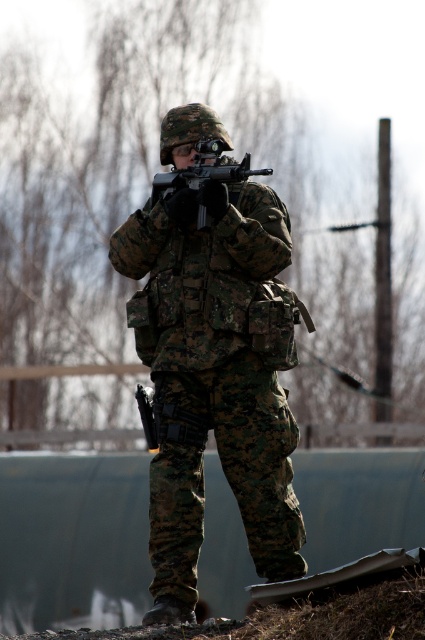
Which is in front, point (241, 260) or point (167, 177)?

Point (241, 260) is in front.

Between point (235, 392) and point (243, 170), which one is positioned behind?

The point (235, 392) is behind.

Where is `camouflage uniform at center`? camouflage uniform at center is located at coordinates (214, 376).